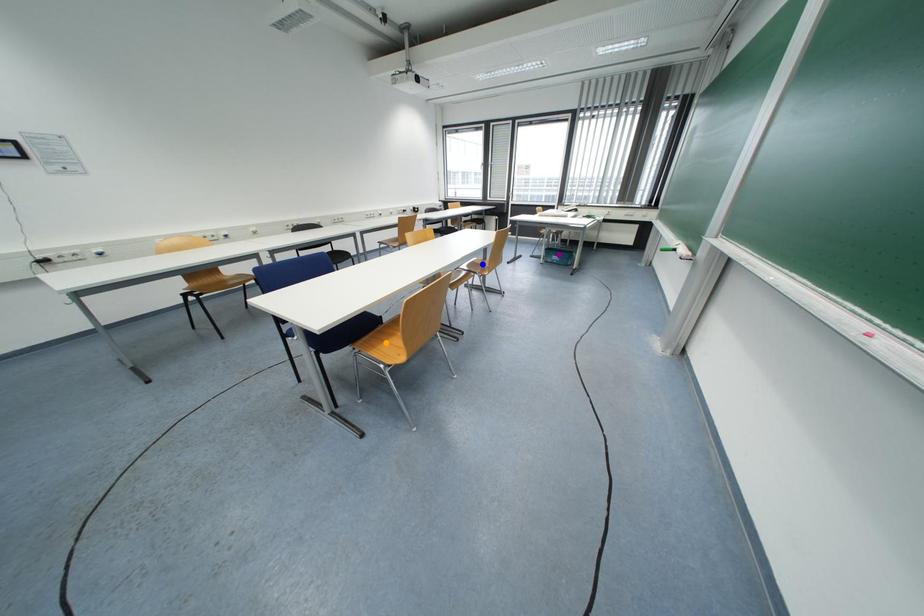
Order these from nearest to farthest:
purple point
orange point
blue point

orange point → blue point → purple point